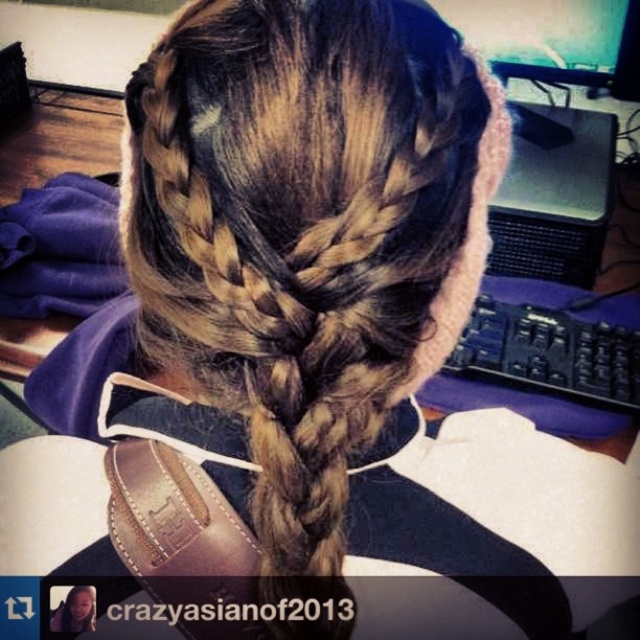
Question: Which point is farther to the camera?

Choices:
 (A) (496, 68)
 (B) (488, 257)

Answer: (A)

Question: Does black plastic computer at right lie behind matte plastic monitor at upper center?

Choices:
 (A) no
 (B) yes

Answer: (A)

Question: Which point is closer to the camera?

Choices:
 (A) black plastic computer at right
 (B) matte plastic monitor at upper center

Answer: (A)

Question: Does black plastic computer at right appear under matte plastic monitor at upper center?

Choices:
 (A) yes
 (B) no

Answer: (A)

Question: Does black plastic computer at right have a greater width compared to matte plastic monitor at upper center?

Choices:
 (A) no
 (B) yes

Answer: (A)